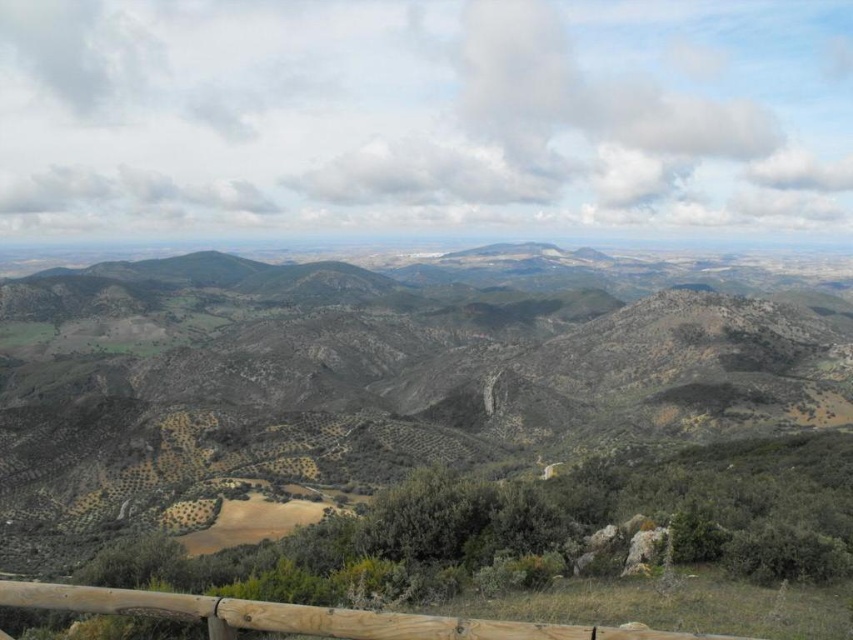
Can you confirm if green grassy hillside at center is taller than brown wooden fence at lower center?

Yes, green grassy hillside at center is taller than brown wooden fence at lower center.

Between green grassy hillside at center and brown wooden fence at lower center, which one has more height?

green grassy hillside at center is taller.

Who is more distant from viewer, (39, 541) or (20, 604)?

Positioned behind is point (39, 541).

In order to click on green grassy hillside at center in this screenshot , I will do `click(372, 376)`.